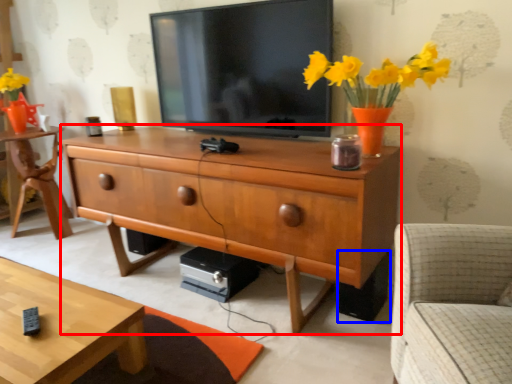
Question: Which object is further to the camera taking this photo, chest of drawers (highlighted by a red box) or speaker (highlighted by a blue box)?

Choices:
 (A) chest of drawers
 (B) speaker

Answer: (B)